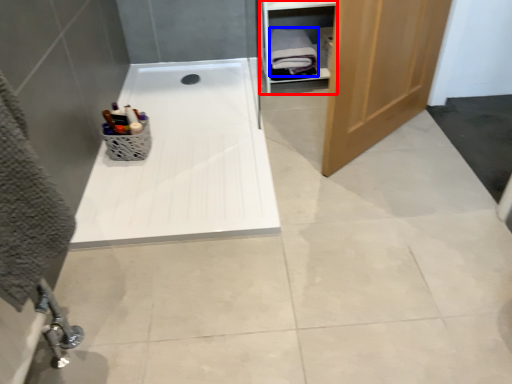
Question: Which of the following is the farthest to the observer, cabinet (highlighted by a red box) or bath towel (highlighted by a blue box)?

Choices:
 (A) cabinet
 (B) bath towel

Answer: (B)